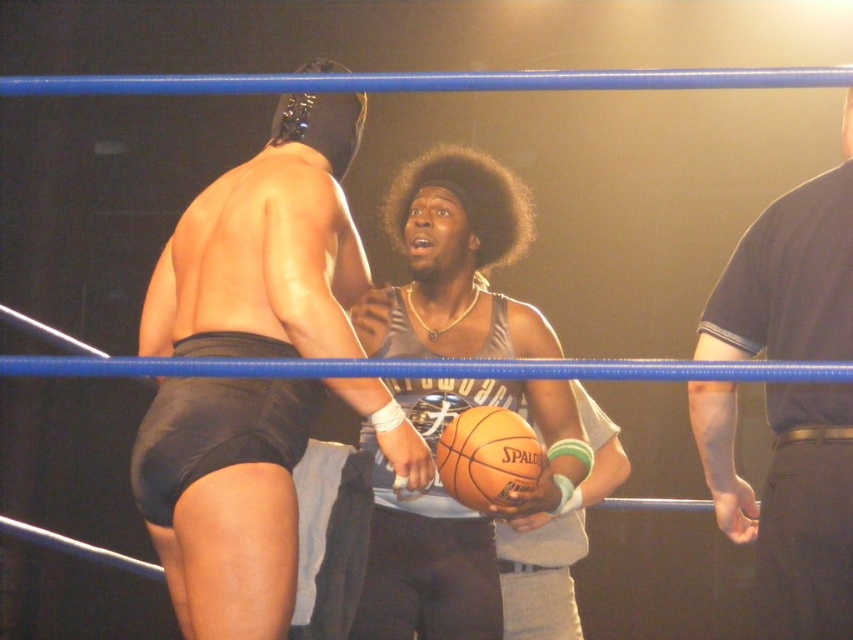
Question: Does shiny black shorts at center come in front of dark gray t-shirt at right?

Choices:
 (A) yes
 (B) no

Answer: (B)

Question: Which of the following is the closest to the observer?

Choices:
 (A) orange leather basketball at center
 (B) metallic silver basketball at center
 (C) dark gray t-shirt at right
 (D) shiny black shorts at center

Answer: (C)

Question: Is metallic silver basketball at center bigger than dark gray t-shirt at right?

Choices:
 (A) no
 (B) yes

Answer: (B)

Question: Is metallic silver basketball at center smaller than dark gray t-shirt at right?

Choices:
 (A) no
 (B) yes

Answer: (A)

Question: Which point is farther from the camera taking this photo?

Choices:
 (A) (229, 280)
 (B) (834, 193)
 (C) (408, 406)
 (D) (450, 488)

Answer: (C)

Question: Which object appears closest to the camera in this image?

Choices:
 (A) dark gray t-shirt at right
 (B) orange leather basketball at center
 (C) shiny black shorts at center

Answer: (A)